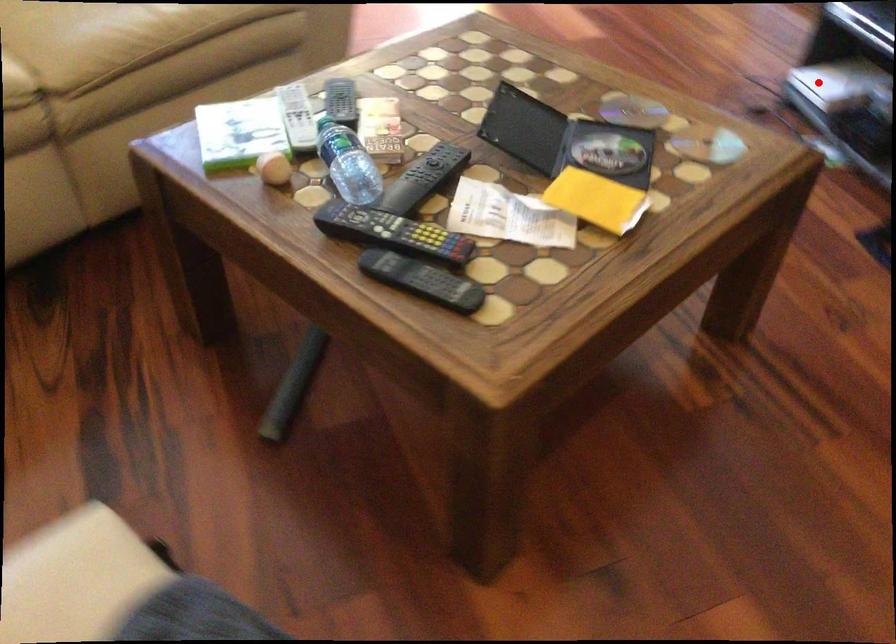
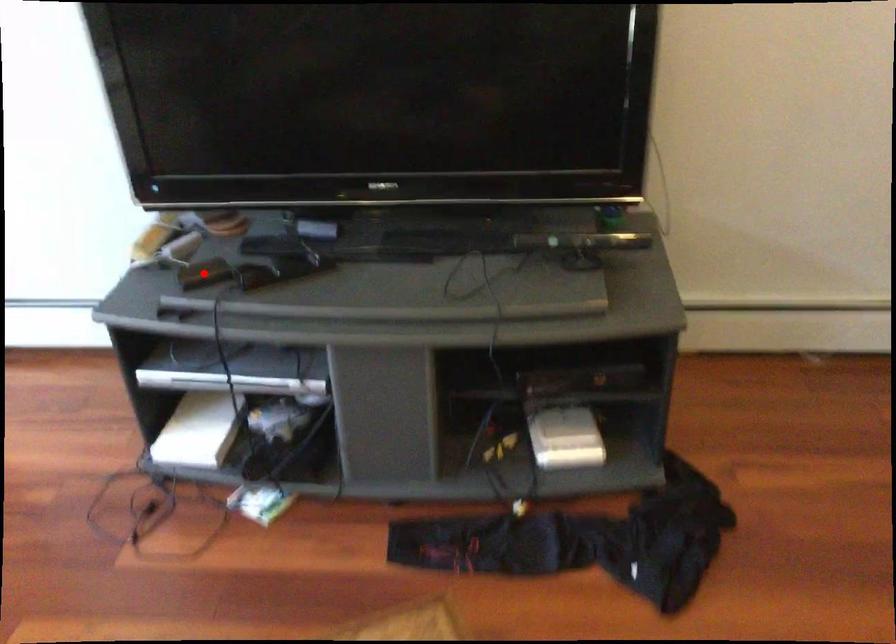
I am providing you with two images of the same scene from different viewpoints. A red point is marked on the first image and another point is marked on the second image. Is the marked point in image1 the same physical position as the marked point in image2?

No